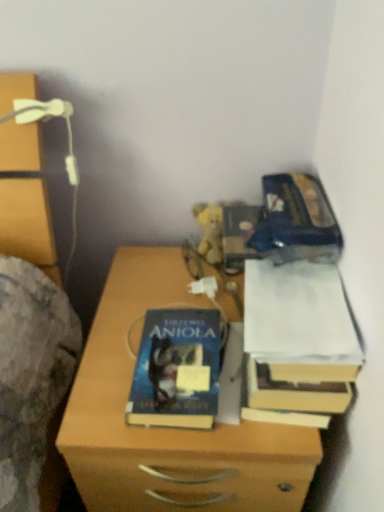
Where is `wooden nightstand at center`? The height and width of the screenshot is (512, 384). wooden nightstand at center is located at coordinates (170, 428).

The height and width of the screenshot is (512, 384). I want to click on white paper at right, so click(299, 338).

Which is more to the left, hardcover book at center or wooden chest of drawers at left?

Positioned to the left is wooden chest of drawers at left.

Is hardcover book at center oriented away from wooden chest of drawers at left?

hardcover book at center does not have its back to wooden chest of drawers at left.

From the picture: From a real-world perspective, is hardcover book at center above or below wooden chest of drawers at left?

Clearly, from a real-world perspective, hardcover book at center is below wooden chest of drawers at left.

Is white paper at right not close to hardcover book at center?

They are positioned close to each other.

Which object is positioned more to the right, white paper at right or hardcover book at center?

white paper at right.

Does point (266, 393) appear closer or farther from the camera than point (200, 381)?

Point (266, 393) is positioned closer to the camera compared to point (200, 381).

Can you confirm if white paper at right is thinner than wooden chest of drawers at left?

Correct, the width of white paper at right is less than that of wooden chest of drawers at left.

From the image's perspective, who appears lower, white paper at right or wooden chest of drawers at left?

white paper at right is shown below in the image.

Can wooden chest of drawers at left be found inside white paper at right?

No, wooden chest of drawers at left is not surrounded by white paper at right.

In the image, is wooden chest of drawers at left on the left side or the right side of hardcover book at center?

In the image, wooden chest of drawers at left appears on the left side of hardcover book at center.

Would you say wooden chest of drawers at left contains hardcover book at center?

A: No, hardcover book at center is not inside wooden chest of drawers at left.

Considering the relative sizes of wooden chest of drawers at left and hardcover book at center in the image provided, is wooden chest of drawers at left smaller than hardcover book at center?

No.

What's the angular difference between wooden chest of drawers at left and wooden nightstand at center's facing directions?

wooden chest of drawers at left and wooden nightstand at center are facing 0.711 degrees away from each other.

Between wooden chest of drawers at left and wooden nightstand at center, which one has less height?

wooden chest of drawers at left is shorter.

From the image's perspective, does wooden chest of drawers at left appear lower than wooden nightstand at center?

No, from the image's perspective, wooden chest of drawers at left is not beneath wooden nightstand at center.

The height and width of the screenshot is (512, 384). In order to click on the chest of drawers above the white paper at right (from the image's perspective) in this screenshot , I will do `click(28, 225)`.

Is wooden chest of drawers at left turned away from white paper at right?

wooden chest of drawers at left is not turned away from white paper at right.

Is wooden chest of drawers at left surrounding white paper at right?

No, white paper at right is not surrounded by wooden chest of drawers at left.

Can you see wooden chest of drawers at left touching white paper at right?

No, wooden chest of drawers at left is not with white paper at right.

From their relative heights in the image, would you say wooden nightstand at center is taller or shorter than hardcover book at center?

wooden nightstand at center is taller than hardcover book at center.

From the image's perspective, which is above, wooden nightstand at center or hardcover book at center?

hardcover book at center is shown above in the image.

Which is more to the right, wooden nightstand at center or hardcover book at center?

wooden nightstand at center.

Is wooden nightstand at center aimed at hardcover book at center?

No, wooden nightstand at center is not oriented towards hardcover book at center.

You are a GUI agent. You are given a task and a screenshot of the screen. Output one action in this format:
    pyautogui.click(x=<x>, y=<y>)
    Task: Click on the book beneath the wooden chest of drawers at left (from a real-world perspective)
    This screenshot has height=512, width=384.
    Given the screenshot: What is the action you would take?
    pyautogui.click(x=176, y=370)

Locate an element on the screen. This screenshot has width=384, height=512. book behind the white paper at right is located at coordinates (176, 370).

Based on their spatial positions, is white paper at right or hardcover book at center closer to wooden nightstand at center?

hardcover book at center lies closer to wooden nightstand at center than the other object.

When comparing their distances from white paper at right, does hardcover book at center or wooden chest of drawers at left seem closer?

Among the two, hardcover book at center is located nearer to white paper at right.

When comparing their distances from wooden nightstand at center, does wooden chest of drawers at left or white paper at right seem closer?

Among the two, white paper at right is located nearer to wooden nightstand at center.

Estimate the real-world distances between objects in this image. Which object is closer to hardcover book at center, white paper at right or wooden nightstand at center?

wooden nightstand at center is closer to hardcover book at center.

Which object lies nearer to the anchor point wooden chest of drawers at left, white paper at right or wooden nightstand at center?

wooden nightstand at center is positioned closer to the anchor wooden chest of drawers at left.

From the image, which object appears to be farther from white paper at right, hardcover book at center or wooden nightstand at center?

wooden nightstand at center lies further to white paper at right than the other object.

Which object lies nearer to the anchor point hardcover book at center, white paper at right or wooden chest of drawers at left?

white paper at right is closer to hardcover book at center.

Looking at this image, when comparing their distances from hardcover book at center, does wooden chest of drawers at left or wooden nightstand at center seem closer?

Based on the image, wooden nightstand at center appears to be nearer to hardcover book at center.

You are a GUI agent. You are given a task and a screenshot of the screen. Output one action in this format:
    pyautogui.click(x=<x>, y=<y>)
    Task: Click on the book between wooden chest of drawers at left and wooden nightstand at center vertically
    This screenshot has height=512, width=384.
    Given the screenshot: What is the action you would take?
    pos(176,370)

Image resolution: width=384 pixels, height=512 pixels. Find the location of `paperback book that lies between wooden chest of drawers at left and wooden nightstand at center from top to bottom`. paperback book that lies between wooden chest of drawers at left and wooden nightstand at center from top to bottom is located at coordinates (299, 338).

In order to click on book between wooden chest of drawers at left and white paper at right in this screenshot , I will do `click(176, 370)`.

The image size is (384, 512). What are the coordinates of `book that lies between white paper at right and wooden nightstand at center from top to bottom` in the screenshot? It's located at (176, 370).